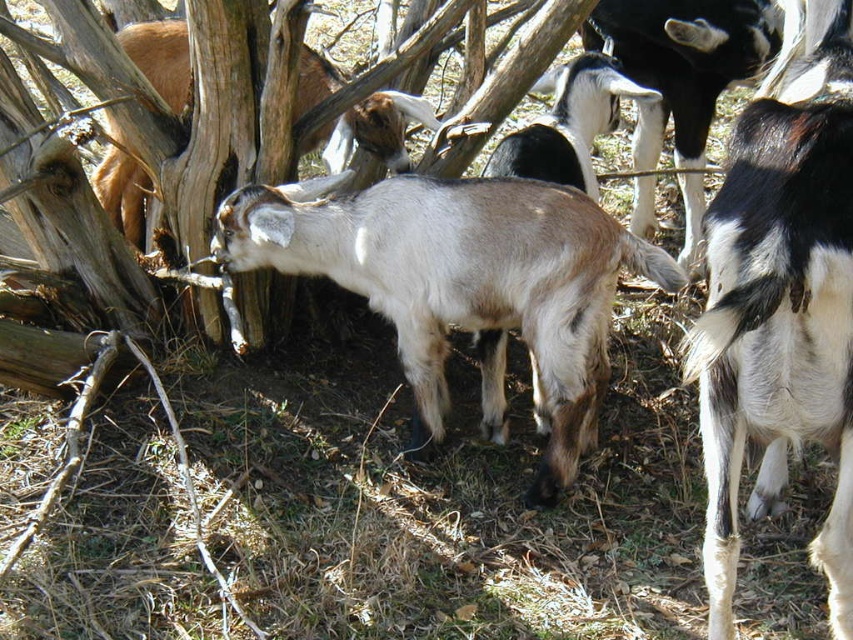
Does light brown woolen goat at center appear under black and white fur goat at center?

Yes.

Which of these two, light brown woolen goat at center or black and white fur goat at center, stands shorter?

Standing shorter between the two is black and white fur goat at center.

This screenshot has height=640, width=853. Identify the location of light brown woolen goat at center. (462, 280).

Who is lower down, light brown woolen goat at center or white woolen goat at center?

light brown woolen goat at center is below.

Based on the photo, does light brown woolen goat at center appear over white woolen goat at center?

No.

The image size is (853, 640). Describe the element at coordinates (462, 280) in the screenshot. I see `light brown woolen goat at center` at that location.

Identify the location of light brown woolen goat at center. (462, 280).

Which is below, white woolen goat at center or black and white fur goat at center?

black and white fur goat at center is lower down.

Can you confirm if white woolen goat at center is positioned below black and white fur goat at center?

No.

Does point (350, 109) come behind point (648, 100)?

No, it is in front of (648, 100).

Image resolution: width=853 pixels, height=640 pixels. Identify the location of white woolen goat at center. (372, 129).